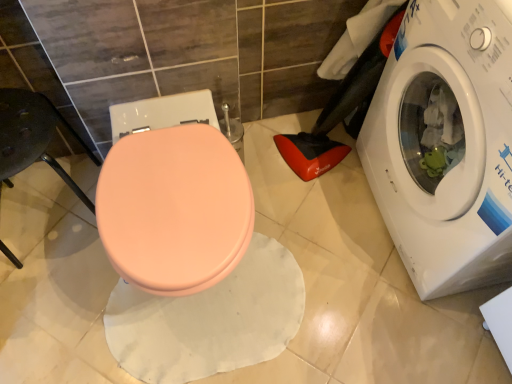
Question: Does matte pink bidet at center appear on the left side of white glossy washing machine at right?

Choices:
 (A) yes
 (B) no

Answer: (A)

Question: Is matte pink bidet at center aimed at white glossy washing machine at right?

Choices:
 (A) no
 (B) yes

Answer: (A)

Question: Is matte pink bidet at center looking in the opposite direction of white glossy washing machine at right?

Choices:
 (A) yes
 (B) no

Answer: (B)

Question: Can you confirm if matte pink bidet at center is positioned to the right of white glossy washing machine at right?

Choices:
 (A) no
 (B) yes

Answer: (A)

Question: Can you confirm if matte pink bidet at center is taller than white glossy washing machine at right?

Choices:
 (A) no
 (B) yes

Answer: (A)

Question: Relative to white glossy washing machine at right, is matte pink bidet at center in front or behind?

Choices:
 (A) front
 (B) behind

Answer: (B)

Question: From a real-world perspective, is matte pink bidet at center physically located above or below white glossy washing machine at right?

Choices:
 (A) above
 (B) below

Answer: (B)

Question: Which is correct: matte pink bidet at center is inside white glossy washing machine at right, or outside of it?

Choices:
 (A) inside
 (B) outside

Answer: (B)

Question: In terms of size, does matte pink bidet at center appear bigger or smaller than white glossy washing machine at right?

Choices:
 (A) big
 (B) small

Answer: (B)

Question: Considering the positions of point (398, 248) and point (1, 246), is point (398, 248) closer or farther from the camera than point (1, 246)?

Choices:
 (A) farther
 (B) closer

Answer: (B)

Question: Is white glossy washing machine at right spatially inside matte pink seat at left, or outside of it?

Choices:
 (A) inside
 (B) outside

Answer: (B)

Question: In terms of height, does white glossy washing machine at right look taller or shorter compared to matte pink seat at left?

Choices:
 (A) tall
 (B) short

Answer: (A)

Question: Looking at the image, does white glossy washing machine at right seem bigger or smaller compared to matte pink seat at left?

Choices:
 (A) big
 (B) small

Answer: (A)

Question: Is matte pink seat at left inside the boundaries of white glossy washing machine at right, or outside?

Choices:
 (A) outside
 (B) inside

Answer: (A)

Question: Considering the relative positions of matte pink seat at left and white glossy washing machine at right in the image provided, is matte pink seat at left to the left or to the right of white glossy washing machine at right?

Choices:
 (A) right
 (B) left

Answer: (B)